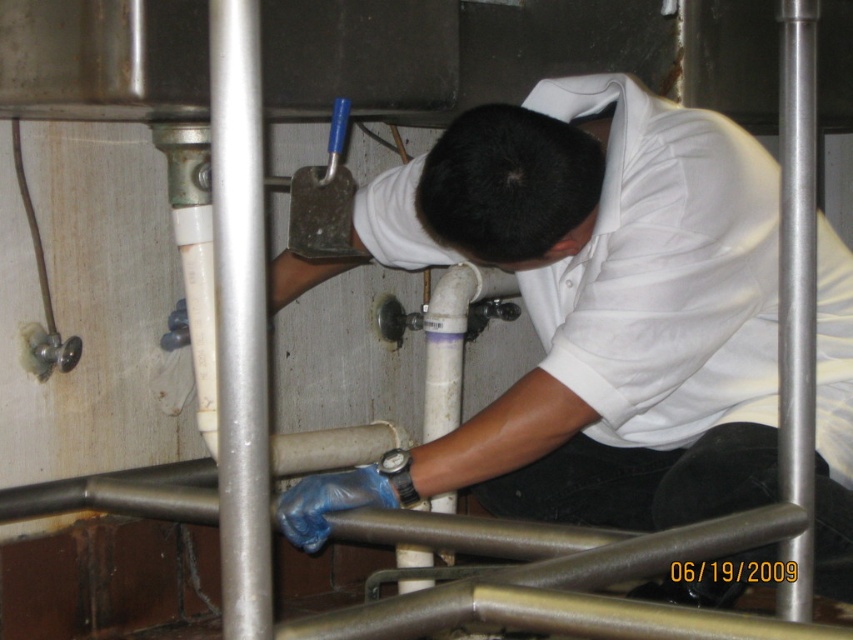
You are an engineer inspecting the industrial setup. There is a point marked at coordinates [241,317]. What object is located at this point?

The point at coordinates [241,317] marks the brushed metal pipe at center left.

You are a safety inspector checking the workspace of the person working under the metallic structure. The coordinates of the white matte shirt at center are point (592, 308). Based on the coordinates, is the white matte shirt at center located in the center of the image?

The white matte shirt at center is represented by point (592, 308), which is very close to the center coordinates of an image, so yes, the white matte shirt at center is located in the center of the image.

You are a safety inspector assessing the workspace. You notice the white matte shirt at center and the brushed metal pipe at center right. Which object is closer to your current position?

The white matte shirt at center is closer to your current position because it is further to the viewer than the brushed metal pipe at center right, meaning it appears nearer in the visual perspective.